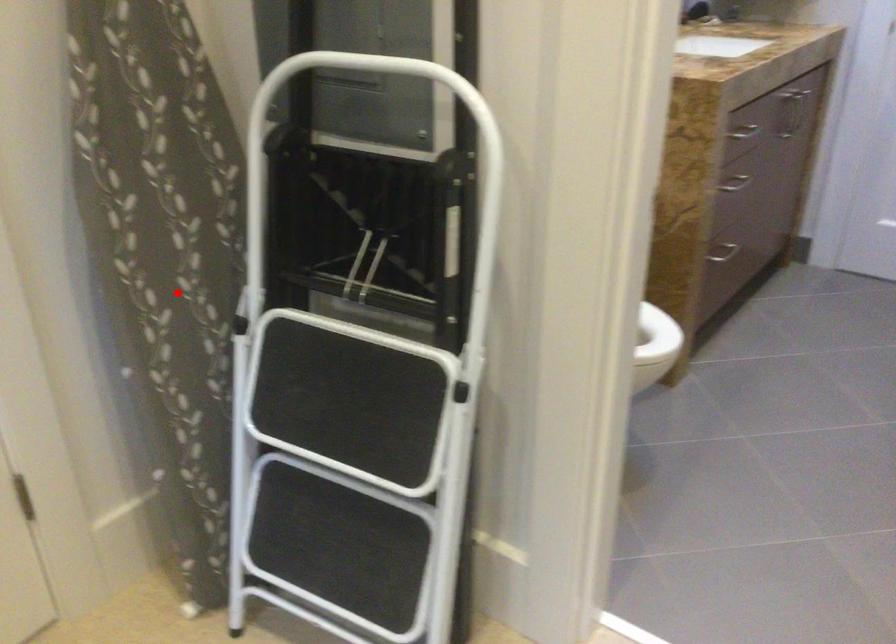
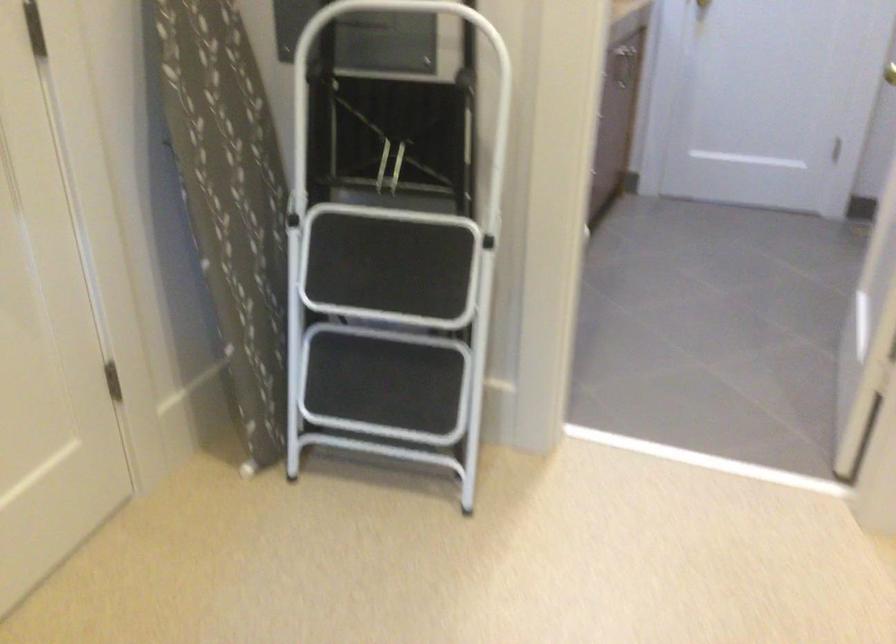
Question: I am providing you with two images of the same scene from different viewpoints. Given a red point in image1, look at the same physical point in image2. Is it:

Choices:
 (A) Closer to the viewpoint
 (B) Farther from the viewpoint

Answer: (B)